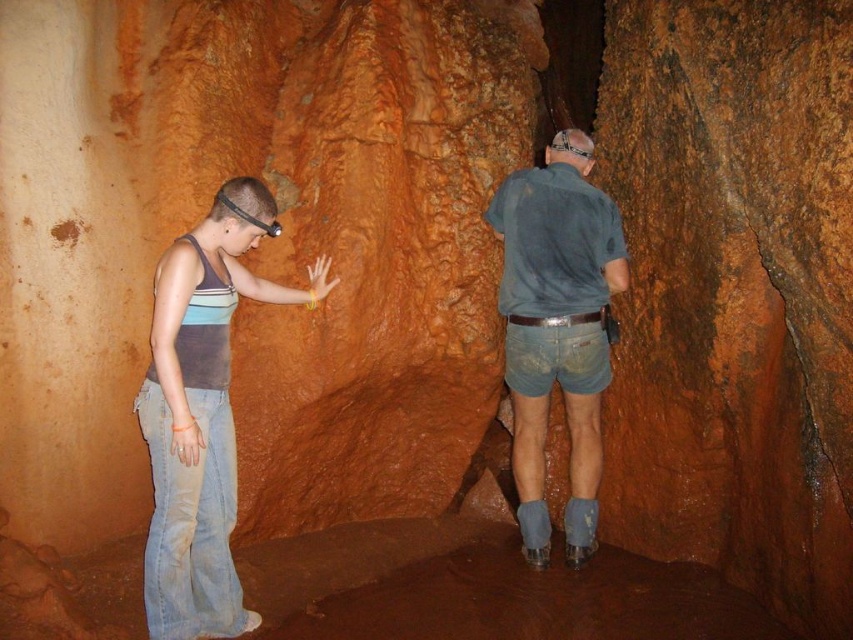
You are a tour guide leading a group through this cave. You notice two visitors wearing denim jeans at left and blue denim shorts at right. If you want to direct the group to the person on the right, which direction should you point?

You should point to the right because the blue denim shorts at right is located to the right of the denim jeans at left.